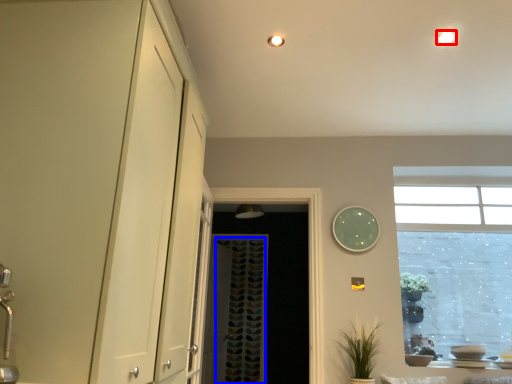
Question: Which point is closer to the camera, lighting (highlighted by a red box) or curtain (highlighted by a blue box)?

Choices:
 (A) lighting
 (B) curtain

Answer: (A)